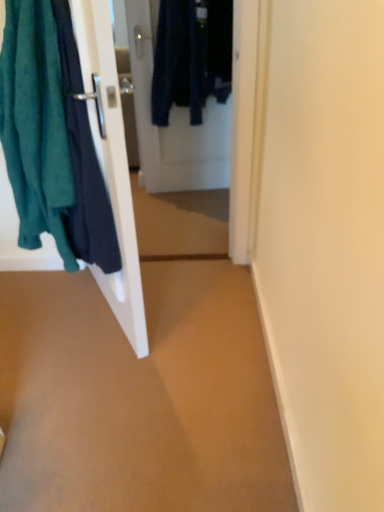
Question: Which direction should I rotate to look at white glossy door at center, positioned as the second door in front-to-back order, — up or down?

Choices:
 (A) down
 (B) up

Answer: (B)

Question: Does brown matte carpet at center appear on the left side of teal fabric towel at left?

Choices:
 (A) yes
 (B) no

Answer: (B)

Question: Does brown matte carpet at center have a greater width compared to teal fabric towel at left?

Choices:
 (A) no
 (B) yes

Answer: (B)

Question: Is brown matte carpet at center surrounding teal fabric towel at left?

Choices:
 (A) no
 (B) yes

Answer: (A)

Question: Can you see brown matte carpet at center touching teal fabric towel at left?

Choices:
 (A) no
 (B) yes

Answer: (A)

Question: Can you confirm if brown matte carpet at center is smaller than teal fabric towel at left?

Choices:
 (A) no
 (B) yes

Answer: (B)

Question: Is brown matte carpet at center thinner than teal fabric towel at left?

Choices:
 (A) yes
 (B) no

Answer: (B)

Question: Is the surface of white glossy door at left, the 1th door in the front-to-back sequence, in direct contact with brown matte carpet at center?

Choices:
 (A) no
 (B) yes

Answer: (A)

Question: Is white glossy door at left, the 1th door in the front-to-back sequence, not close to brown matte carpet at center?

Choices:
 (A) yes
 (B) no

Answer: (B)

Question: Is white glossy door at left, positioned as the second door in back-to-front order, aimed at brown matte carpet at center?

Choices:
 (A) no
 (B) yes

Answer: (A)

Question: From the image's perspective, would you say white glossy door at left, positioned as the second door in back-to-front order, is shown under brown matte carpet at center?

Choices:
 (A) no
 (B) yes

Answer: (A)

Question: Is white glossy door at left, positioned as the second door in back-to-front order, oriented away from brown matte carpet at center?

Choices:
 (A) no
 (B) yes

Answer: (A)

Question: Does white glossy door at left, the 1th door in the front-to-back sequence, come in front of brown matte carpet at center?

Choices:
 (A) no
 (B) yes

Answer: (B)

Question: Is the depth of white glossy door at center, positioned as the second door in front-to-back order, greater than that of white glossy door at left, positioned as the second door in back-to-front order?

Choices:
 (A) no
 (B) yes

Answer: (B)